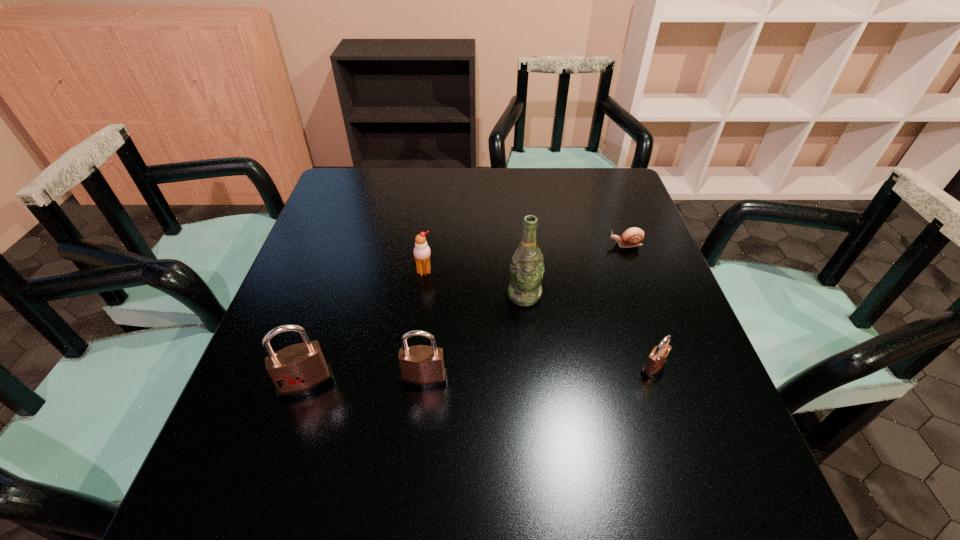
If the aim is uniform spacing by inserting an additional padlock among them, please point to a vacant space for this new padlock. Please provide its 2D coordinates. Your answer should be formatted as a tuple, i.e. [(x, y)], where the tuple contains the x and y coordinates of a point satisfying the conditions above.

[(540, 374)]